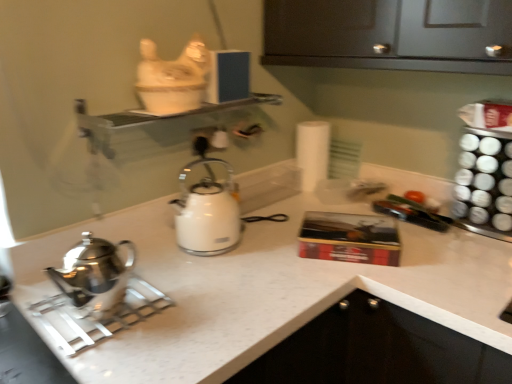
Question: Are white glossy kettle at center, which is the 2th kettle from front to back, and white matte toilet paper at center far apart?

Choices:
 (A) no
 (B) yes

Answer: (A)

Question: Is white glossy kettle at center, the second kettle from the left, thinner than white matte toilet paper at center?

Choices:
 (A) no
 (B) yes

Answer: (A)

Question: Is white glossy kettle at center, which is the 2th kettle from front to back, at the left side of white matte toilet paper at center?

Choices:
 (A) no
 (B) yes

Answer: (B)

Question: From the image's perspective, does white glossy kettle at center, which is the 2th kettle from front to back, appear lower than white matte toilet paper at center?

Choices:
 (A) yes
 (B) no

Answer: (A)

Question: From the image's perspective, would you say white glossy kettle at center, which is the 2th kettle from front to back, is positioned over white matte toilet paper at center?

Choices:
 (A) no
 (B) yes

Answer: (A)

Question: From a real-world perspective, is white glossy kettle at center, positioned as the first kettle in back-to-front order, beneath white matte toilet paper at center?

Choices:
 (A) no
 (B) yes

Answer: (A)

Question: Is white glossy kettle at center, the 1th kettle from the right, taller than polished stainless steel kettle at left, acting as the first kettle starting from the left?

Choices:
 (A) no
 (B) yes

Answer: (B)

Question: Considering the relative positions of white glossy kettle at center, the 1th kettle from the right, and polished stainless steel kettle at left, the second kettle positioned from the back, in the image provided, is white glossy kettle at center, the 1th kettle from the right, in front of polished stainless steel kettle at left, the second kettle positioned from the back,?

Choices:
 (A) yes
 (B) no

Answer: (B)

Question: From the image's perspective, does white glossy kettle at center, the 1th kettle from the right, appear lower than polished stainless steel kettle at left, the second kettle positioned from the back?

Choices:
 (A) no
 (B) yes

Answer: (A)

Question: From the image's perspective, would you say white glossy kettle at center, which is the 2th kettle from front to back, is positioned over polished stainless steel kettle at left, the second kettle when ordered from right to left?

Choices:
 (A) yes
 (B) no

Answer: (A)

Question: Is polished stainless steel kettle at left, which is the first kettle from front to back, surrounded by white glossy kettle at center, the second kettle from the left?

Choices:
 (A) no
 (B) yes

Answer: (A)

Question: From a real-world perspective, is white glossy kettle at center, the 1th kettle from the right, beneath polished stainless steel kettle at left, acting as the first kettle starting from the left?

Choices:
 (A) no
 (B) yes

Answer: (A)

Question: Are polished stainless steel kettle at left, acting as the first kettle starting from the left, and white matte toilet paper at center located far from each other?

Choices:
 (A) no
 (B) yes

Answer: (A)